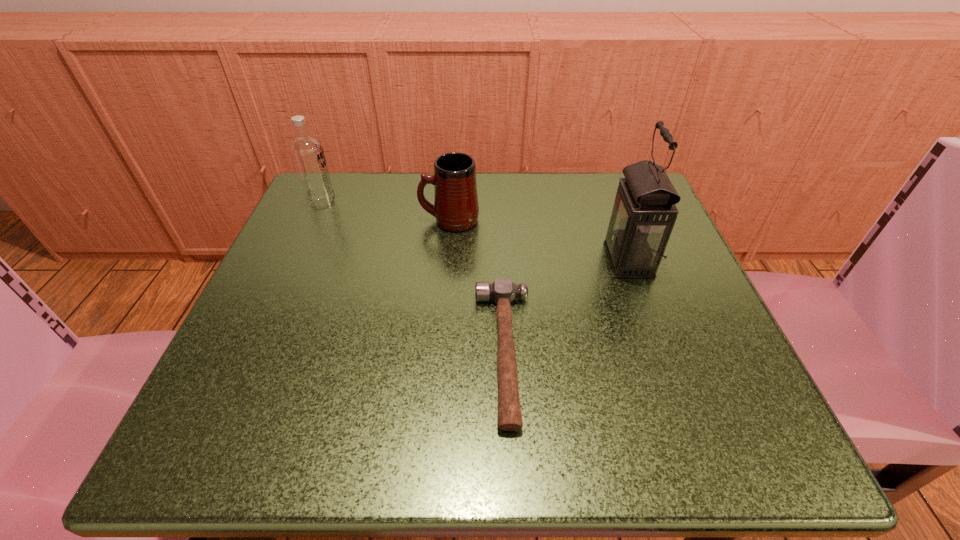
In order to click on vacant region between the shortest object and the rightmost object in this screenshot , I will do `click(566, 306)`.

This screenshot has height=540, width=960. What are the coordinates of `vacant space that's between the rightmost object and the mug` in the screenshot? It's located at (539, 240).

At what (x,y) coordinates should I click in order to perform the action: click on vacant point located between the second nearest object and the third shortest object. Please return your answer as a coordinate pair (x, y). The height and width of the screenshot is (540, 960). Looking at the image, I should click on (475, 232).

Image resolution: width=960 pixels, height=540 pixels. Identify the location of free space between the shortest object and the lantern. (566, 306).

The width and height of the screenshot is (960, 540). I want to click on free spot between the third tallest object and the third farthest object, so click(x=539, y=240).

I want to click on vacant point located between the mug and the vodka, so click(386, 212).

Where is `empty space between the leftmost object and the shortest object`? empty space between the leftmost object and the shortest object is located at coordinates (414, 279).

Identify which object is located as the third nearest to the mug. Please provide its 2D coordinates. Your answer should be formatted as a tuple, i.e. [(x, y)], where the tuple contains the x and y coordinates of a point satisfying the conditions above.

[(644, 213)]

Locate which object is the third closest to the third shortest object. Please provide its 2D coordinates. Your answer should be formatted as a tuple, i.e. [(x, y)], where the tuple contains the x and y coordinates of a point satisfying the conditions above.

[(644, 213)]